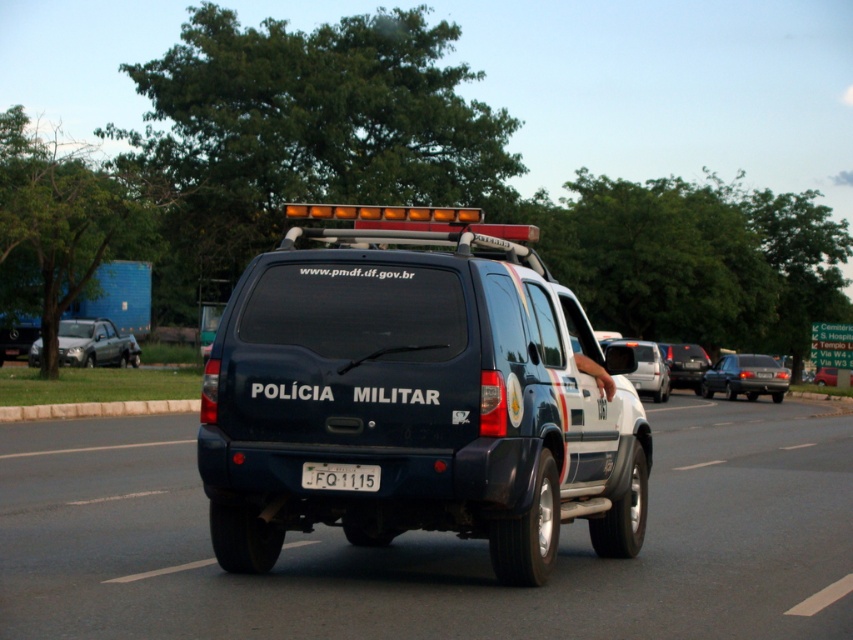
Question: Which of the following is the closest to the observer?

Choices:
 (A) metallic gray sedan at center
 (B) white glossy suv at center
 (C) silver metallic hatchback at left
 (D) matte black suv at center

Answer: (B)

Question: Is white plastic license plate at center smaller than metallic blue suv at center?

Choices:
 (A) yes
 (B) no

Answer: (A)

Question: Can you confirm if white plastic license plate at center is smaller than matte black suv at center?

Choices:
 (A) no
 (B) yes

Answer: (B)

Question: Is the position of glossy black suv at center less distant than that of metallic blue suv at center?

Choices:
 (A) no
 (B) yes

Answer: (B)

Question: Which object appears farthest from the camera in this image?

Choices:
 (A) white plastic license plate at center
 (B) silver metallic hatchback at left
 (C) matte blue suv at center

Answer: (B)

Question: Which point is closer to the camera?

Choices:
 (A) (96, 333)
 (B) (724, 371)

Answer: (B)